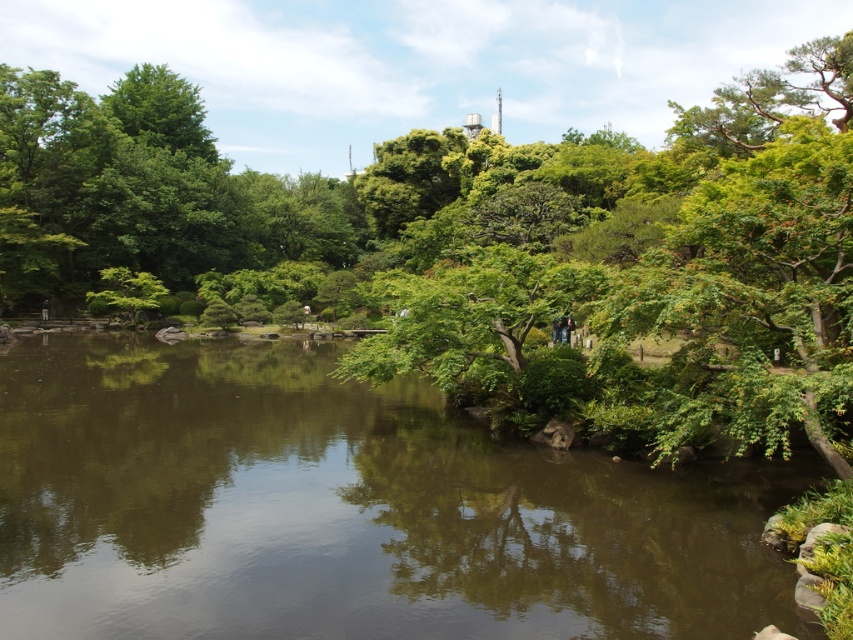
Question: Among these objects, which one is nearest to the camera?

Choices:
 (A) green leafy tree at center
 (B) green reflective water at center

Answer: (B)

Question: In this image, where is green leafy tree at center located relative to green reflective water at center?

Choices:
 (A) left
 (B) right

Answer: (A)

Question: Which point is closer to the camera?

Choices:
 (A) 213,563
 (B) 33,179

Answer: (A)

Question: Is green leafy tree at center positioned at the back of green reflective water at center?

Choices:
 (A) no
 (B) yes

Answer: (B)

Question: Can you confirm if green leafy tree at center is positioned to the right of green reflective water at center?

Choices:
 (A) no
 (B) yes

Answer: (A)